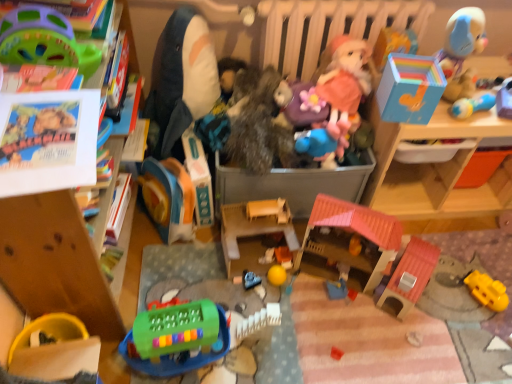
Question: Does green plastic keyboard at lower left, the twelfth toy viewed from the right, appear on the right side of wooden toy storage at upper right?

Choices:
 (A) no
 (B) yes

Answer: (A)

Question: Can you confirm if green plastic keyboard at lower left, the twelfth toy viewed from the right, is wider than wooden toy storage at upper right?

Choices:
 (A) no
 (B) yes

Answer: (A)

Question: Is green plastic keyboard at lower left, the twelfth toy viewed from the right, next to wooden toy storage at upper right?

Choices:
 (A) no
 (B) yes

Answer: (A)

Question: Is the depth of green plastic keyboard at lower left, the twelfth toy viewed from the right, greater than that of wooden toy storage at upper right?

Choices:
 (A) no
 (B) yes

Answer: (A)

Question: Is green plastic keyboard at lower left, the 5th toy viewed from the left, in front of wooden toy storage at upper right?

Choices:
 (A) no
 (B) yes

Answer: (B)

Question: Can you confirm if green plastic keyboard at lower left, the 5th toy viewed from the left, is thinner than wooden toy storage at upper right?

Choices:
 (A) no
 (B) yes

Answer: (B)

Question: From the image's perspective, would you say blue cardboard storage box at upper right, which is the 2th storage box from left to right, is positioned over pink fabric doll at center, positioned as the 11th toy in left-to-right order?

Choices:
 (A) no
 (B) yes

Answer: (A)

Question: Can pink fabric doll at center, positioned as the 11th toy in left-to-right order, be found inside blue cardboard storage box at upper right, the 2th storage box viewed from the back?

Choices:
 (A) no
 (B) yes

Answer: (A)

Question: From the image's perspective, would you say blue cardboard storage box at upper right, positioned as the first storage box in right-to-left order, is shown under pink fabric doll at center, placed as the 6th toy when sorted from right to left?

Choices:
 (A) yes
 (B) no

Answer: (A)

Question: Is blue cardboard storage box at upper right, marked as the 1th storage box in a front-to-back arrangement, facing towards pink fabric doll at center, positioned as the 11th toy in left-to-right order?

Choices:
 (A) yes
 (B) no

Answer: (B)

Question: From a real-world perspective, is blue cardboard storage box at upper right, the 2th storage box viewed from the back, located beneath pink fabric doll at center, positioned as the 11th toy in left-to-right order?

Choices:
 (A) yes
 (B) no

Answer: (B)

Question: Is blue cardboard storage box at upper right, which is the 2th storage box from left to right, turned away from pink fabric doll at center, positioned as the 11th toy in left-to-right order?

Choices:
 (A) no
 (B) yes

Answer: (A)

Question: Considering the relative sizes of blue rubber duck at center, placed as the 5th toy when sorted from right to left, and smooth orange block at center, arranged as the seventh toy when viewed from the right, in the image provided, is blue rubber duck at center, placed as the 5th toy when sorted from right to left, taller than smooth orange block at center, arranged as the seventh toy when viewed from the right,?

Choices:
 (A) yes
 (B) no

Answer: (A)